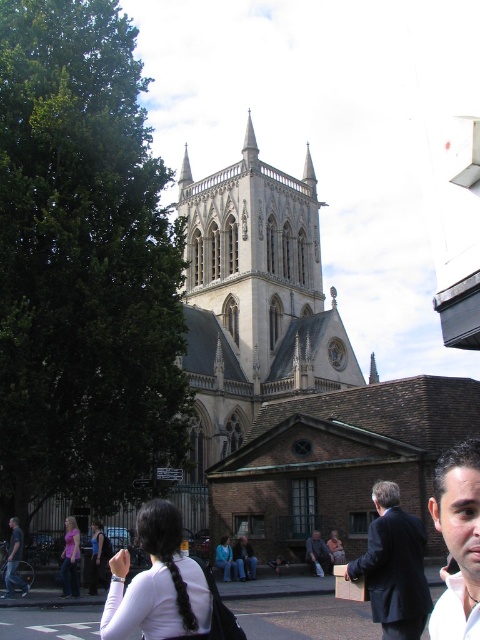
Question: Is dark blue jeans at lower left to the left of dark blue suit at center from the viewer's perspective?

Choices:
 (A) no
 (B) yes

Answer: (B)

Question: Which of these objects is positioned farthest from the matte black suit at center?

Choices:
 (A) smooth skin face at lower right
 (B) dark blue jeans at lower left
 (C) dark blue suit at center
 (D) light pink fabric shirt at lower left

Answer: (B)

Question: Which point is closer to the camera?

Choices:
 (A) (17, 584)
 (B) (69, 516)
 (C) (474, 634)

Answer: (C)

Question: Which point appears farthest from the camera in this image?

Choices:
 (A) (23, 538)
 (B) (305, 556)
 (C) (368, 548)
 (D) (78, 536)

Answer: (B)

Question: Does dark blue jeans at lower left appear under dark blue suit at center?

Choices:
 (A) yes
 (B) no

Answer: (B)

Question: Does light pink fabric shirt at lower left appear under dark blue suit at center?

Choices:
 (A) no
 (B) yes

Answer: (A)